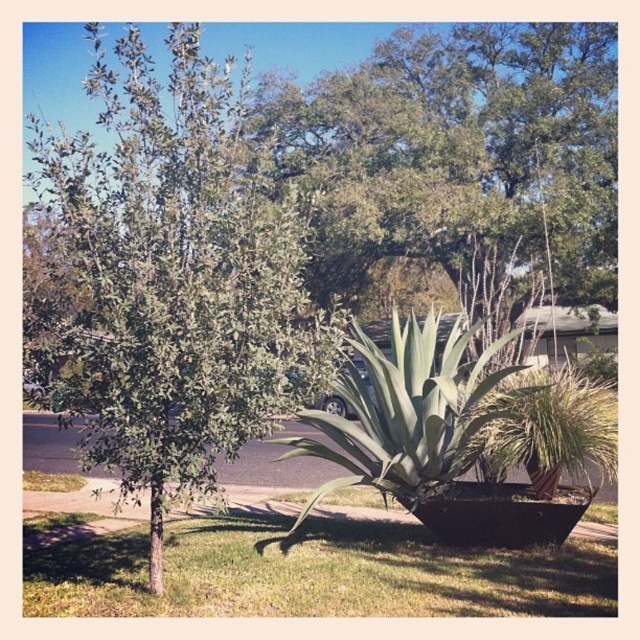
Does green leafy tree at upper left have a lesser height compared to green grass at lower center?

No.

Can you confirm if green leafy tree at upper left is positioned above green grass at lower center?

Correct, green leafy tree at upper left is located above green grass at lower center.

Find the location of a particular element. green leafy tree at upper left is located at coordinates (464, 161).

The width and height of the screenshot is (640, 640). What are the coordinates of `green leafy tree at upper left` in the screenshot? It's located at (464, 161).

Which of these two, green leafy tree at upper left or green leafy plant at center, stands taller?

Standing taller between the two is green leafy tree at upper left.

Based on the photo, does green leafy tree at upper left have a lesser width compared to green leafy plant at center?

No.

This screenshot has height=640, width=640. Identify the location of green leafy tree at upper left. (464, 161).

Who is more forward, [120,276] or [540,420]?

Point [120,276]

Between green leafy tree at left and green leafy plant at center, which one is positioned higher?

green leafy tree at left

Is point (209, 76) less distant than point (513, 410)?

Yes, it is in front of point (513, 410).

Image resolution: width=640 pixels, height=640 pixels. I want to click on green leafy tree at left, so click(x=179, y=273).